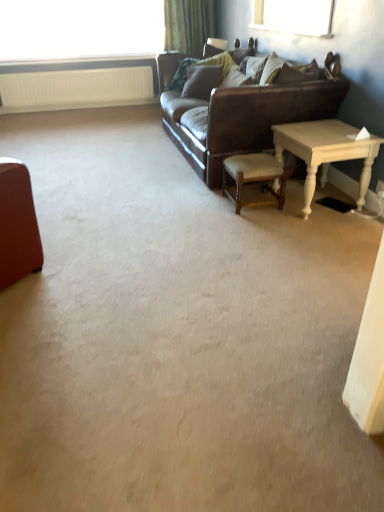
Question: From the image's perspective, relative to green fabric curtain at upper center, is wooden chair at center above or below?

Choices:
 (A) below
 (B) above

Answer: (A)

Question: Is point (258, 180) positioned closer to the camera than point (206, 12)?

Choices:
 (A) closer
 (B) farther

Answer: (A)

Question: Estimate the real-world distances between objects in this image. Which object is closer to the white painted wood table at right?

Choices:
 (A) textured beige pillow at upper right
 (B) wooden chair at center
 (C) green fabric curtain at upper center
 (D) leather couch at center
 (E) transparent glass window at upper left

Answer: (B)

Question: Which object is positioned farthest from the white painted wood table at right?

Choices:
 (A) textured beige pillow at upper right
 (B) wooden chair at center
 (C) green fabric curtain at upper center
 (D) white textured radiator at upper left
 (E) transparent glass window at upper left

Answer: (E)